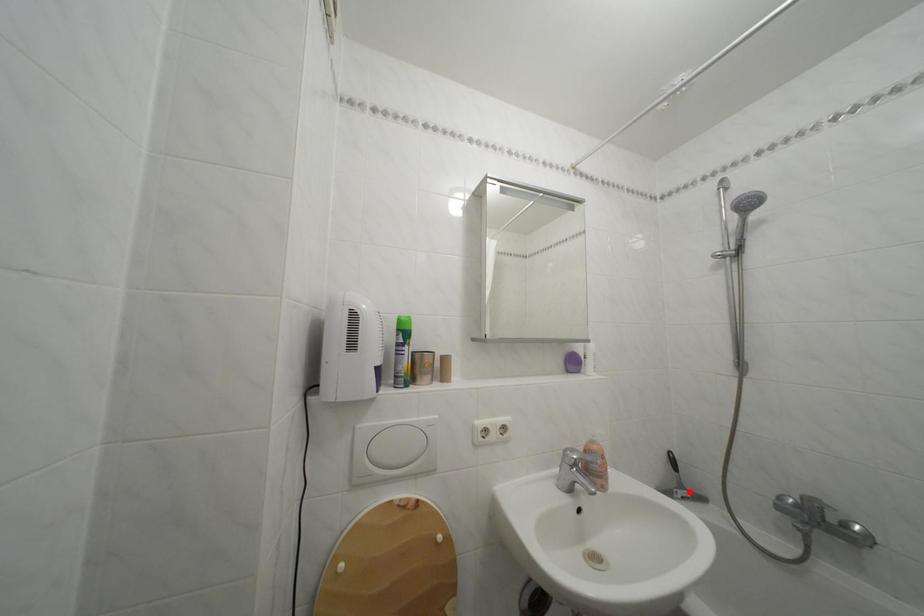
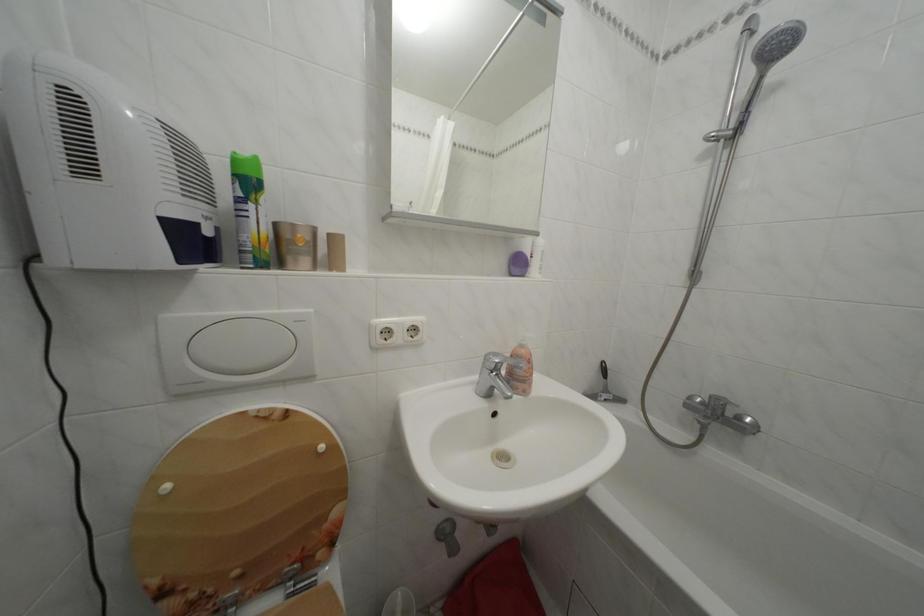
The point at the highlighted location is marked in the first image. Where is the corresponding point in the second image?

(614, 397)